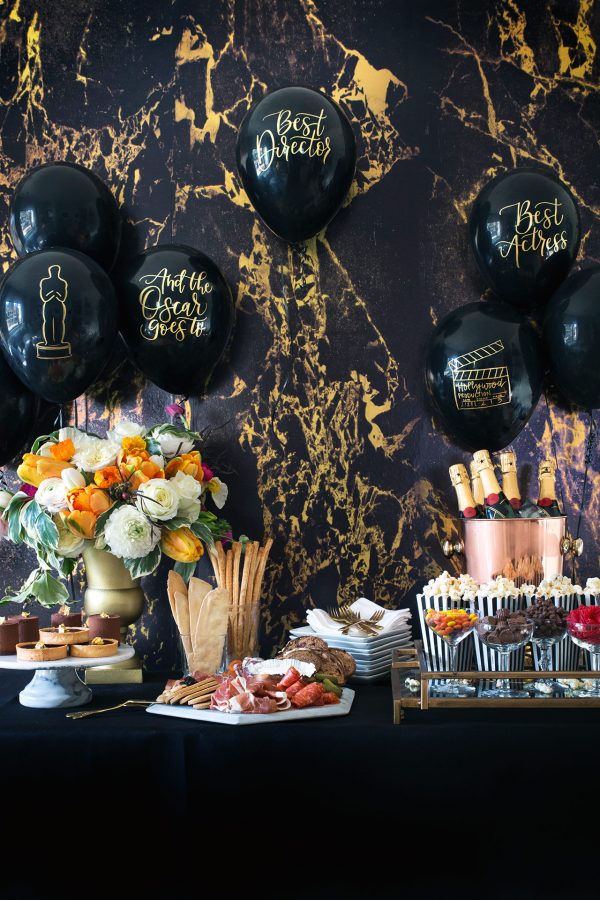
The image size is (600, 900). I want to click on table, so click(x=372, y=714).